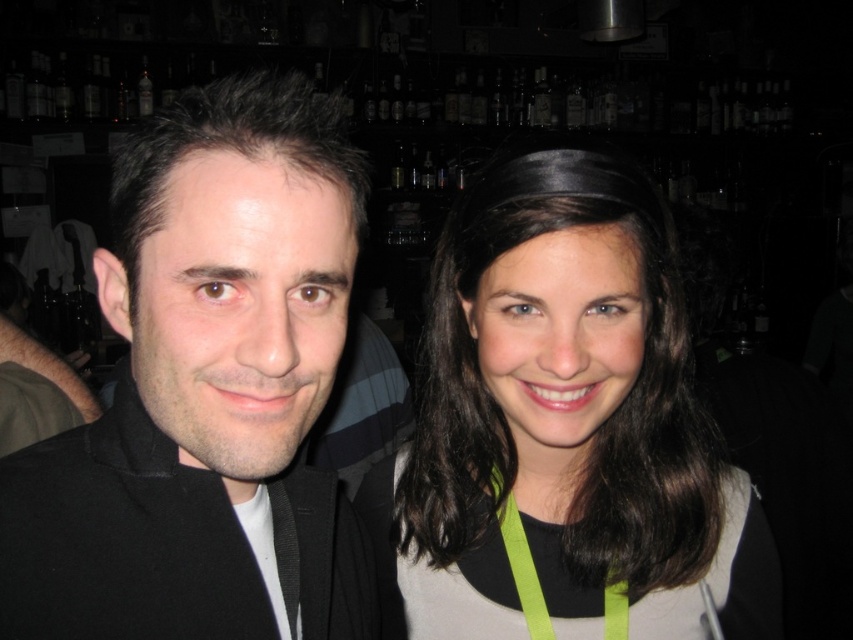
From the picture: You are a security guard in a bar and need to locate the black matte jacket at left. According to the coordinates provided, where exactly should you look to find it?

The black matte jacket at left is located at coordinates point (x=206, y=392).

You are a photographer adjusting the camera focus. The smooth brown hair at center and the green fabric lanyard at center are both in the frame. Which object should you focus on first if you want to ensure the wider one is sharp?

The smooth brown hair at center has a greater width than the green fabric lanyard at center, so you should focus on the smooth brown hair at center first to ensure the wider object is sharp.